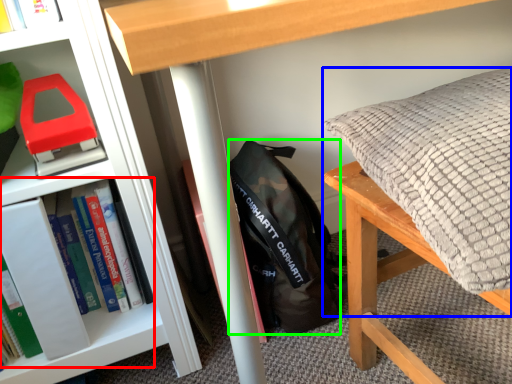
Question: Which object is positioned closest to book (highlighted by a red box)? Select from pillow (highlighted by a blue box) and backpack (highlighted by a green box).

Choices:
 (A) pillow
 (B) backpack

Answer: (B)